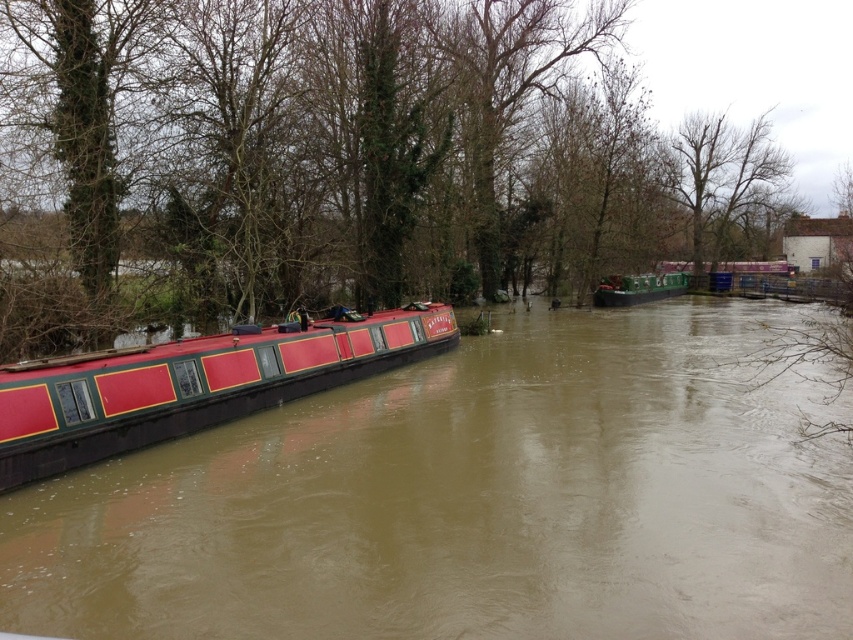
Based on the photo, you are a delivery person needing to load a tall package onto a barge. You see the matte red barge at left and the green matte barge at center. Which barge has enough clearance for the tall package?

The green matte barge at center has a greater height than the matte red barge at left, so it has enough clearance for the tall package.

You are a photographer standing at the center of the canal. You want to take a photo of the matte red boat at left. According to the coordinates provided, in which direction should you move to get the best shot?

The matte red boat at left is located at coordinates point (471,500). Since you are standing at the center, you should move to the left to align yourself with the boat for the best shot.

You are a boat inspector who needs to board both the matte red barge at left and the green matte barge at center. Given that the inspection platform can only accommodate one barge at a time, which barge should you inspect first to minimize the time spent moving between them?

You should inspect the matte red barge at left first because it is smaller and likely requires less time for inspection, allowing you to move to the green matte barge at center more quickly.